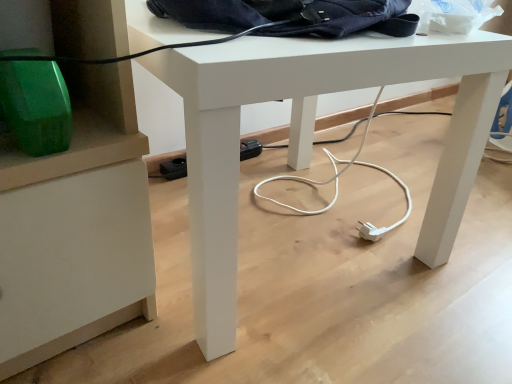
Image resolution: width=512 pixels, height=384 pixels. Describe the element at coordinates (291, 16) in the screenshot. I see `navy blue fabric messenger bag at upper center` at that location.

Identify the location of navy blue fabric messenger bag at upper center. This screenshot has width=512, height=384. (291, 16).

The width and height of the screenshot is (512, 384). Identify the location of white matte desk at center. (x=313, y=134).

The width and height of the screenshot is (512, 384). What do you see at coordinates (313, 134) in the screenshot?
I see `white matte desk at center` at bounding box center [313, 134].

The width and height of the screenshot is (512, 384). Identify the location of navy blue fabric messenger bag at upper center. (291, 16).

Considering the relative positions of navy blue fabric messenger bag at upper center and white matte desk at center in the image provided, is navy blue fabric messenger bag at upper center to the left or to the right of white matte desk at center?

navy blue fabric messenger bag at upper center is to the right of white matte desk at center.

From the picture: Is navy blue fabric messenger bag at upper center in front of white matte desk at center?

No, navy blue fabric messenger bag at upper center is further to the viewer.

Is point (293, 30) in front of point (234, 192)?

That is False.

From the image's perspective, is navy blue fabric messenger bag at upper center on top of white matte desk at center?

Yes.

From a real-world perspective, between navy blue fabric messenger bag at upper center and white matte desk at center, who is vertically higher?

navy blue fabric messenger bag at upper center is physically above.

Based on the photo, which of these two, navy blue fabric messenger bag at upper center or white matte desk at center, is thinner?

With smaller width is navy blue fabric messenger bag at upper center.

Between navy blue fabric messenger bag at upper center and white matte desk at center, which one has less height?

navy blue fabric messenger bag at upper center.

Does navy blue fabric messenger bag at upper center have a larger size compared to white matte desk at center?

No.

Can white matte desk at center be found inside navy blue fabric messenger bag at upper center?

No, white matte desk at center is not surrounded by navy blue fabric messenger bag at upper center.

Is navy blue fabric messenger bag at upper center in contact with white matte desk at center?

No, navy blue fabric messenger bag at upper center is not in contact with white matte desk at center.

Is navy blue fabric messenger bag at upper center facing away from white matte desk at center?

No, navy blue fabric messenger bag at upper center's orientation is not away from white matte desk at center.

I want to click on desk below the navy blue fabric messenger bag at upper center (from a real-world perspective), so click(x=313, y=134).

Can you confirm if white matte desk at center is positioned to the right of navy blue fabric messenger bag at upper center?

In fact, white matte desk at center is to the left of navy blue fabric messenger bag at upper center.

Looking at this image, is white matte desk at center positioned before navy blue fabric messenger bag at upper center?

Yes, white matte desk at center is in front of navy blue fabric messenger bag at upper center.

Which is more distant, (404, 63) or (333, 6)?

The point (333, 6) is farther from the camera.

From the image's perspective, is white matte desk at center beneath navy blue fabric messenger bag at upper center?

Indeed, from the image's perspective, white matte desk at center is shown beneath navy blue fabric messenger bag at upper center.

From a real-world perspective, is white matte desk at center located higher than navy blue fabric messenger bag at upper center?

No.

Which object is thinner, white matte desk at center or navy blue fabric messenger bag at upper center?

Thinner between the two is navy blue fabric messenger bag at upper center.

Looking at this image, between white matte desk at center and navy blue fabric messenger bag at upper center, which one has less height?

With less height is navy blue fabric messenger bag at upper center.

Considering the sizes of objects white matte desk at center and navy blue fabric messenger bag at upper center in the image provided, who is smaller, white matte desk at center or navy blue fabric messenger bag at upper center?

navy blue fabric messenger bag at upper center is smaller.

Would you say white matte desk at center contains navy blue fabric messenger bag at upper center?

No, navy blue fabric messenger bag at upper center is not inside white matte desk at center.

Is white matte desk at center far away from navy blue fabric messenger bag at upper center?

No, there isn't a large distance between white matte desk at center and navy blue fabric messenger bag at upper center.

Is white matte desk at center positioned with its back to navy blue fabric messenger bag at upper center?

white matte desk at center does not have its back to navy blue fabric messenger bag at upper center.

Can you tell me how much white matte desk at center and navy blue fabric messenger bag at upper center differ in facing direction?

There is a 0.000793-degree angle between the facing directions of white matte desk at center and navy blue fabric messenger bag at upper center.

You are a GUI agent. You are given a task and a screenshot of the screen. Output one action in this format:
    pyautogui.click(x=<x>, y=<y>)
    Task: Click on the desk located underneath the navy blue fabric messenger bag at upper center (from a real-world perspective)
    This screenshot has height=384, width=512.
    Given the screenshot: What is the action you would take?
    pyautogui.click(x=313, y=134)

You are a GUI agent. You are given a task and a screenshot of the screen. Output one action in this format:
    pyautogui.click(x=<x>, y=<y>)
    Task: Click on the desk in front of the navy blue fabric messenger bag at upper center
    This screenshot has height=384, width=512.
    Given the screenshot: What is the action you would take?
    pyautogui.click(x=313, y=134)

Where is `desk directly beneath the navy blue fabric messenger bag at upper center (from a real-world perspective)`? This screenshot has width=512, height=384. desk directly beneath the navy blue fabric messenger bag at upper center (from a real-world perspective) is located at coordinates (313, 134).